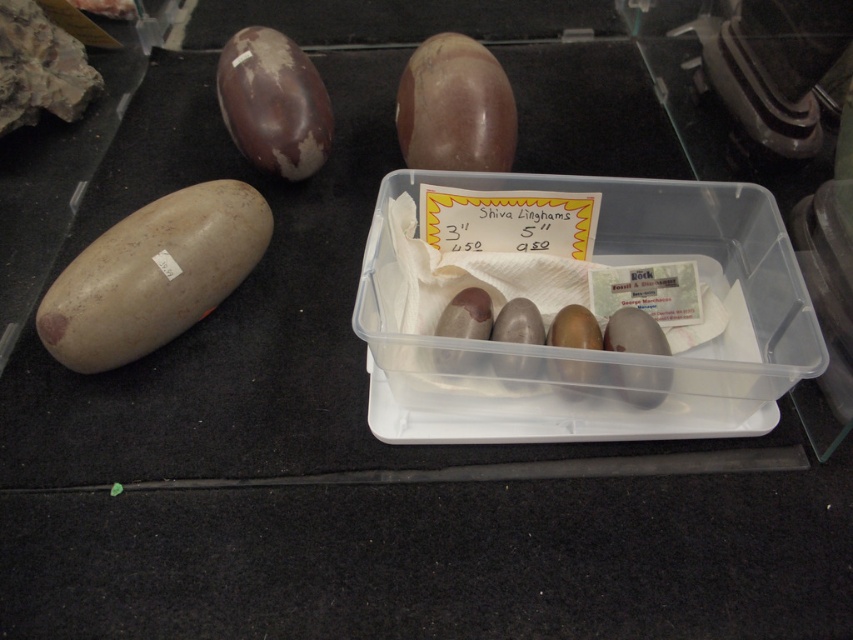
You are a customer at a store and see the matte brown potato at left and the brown matte egg at upper left displayed on a dark surface. Which object is taller?

The matte brown potato at left is taller than the brown matte egg at upper left.

Based on the scene description, where is the matte brown potato at left located in the image?

The matte brown potato at left is located at point (154,275) in the image.

You are a customer at a store and want to buy a Shiva Lingham. You see the shiny brown stone at upper center and the brown matte egg at upper left. Which one is shorter in height?

The shiny brown stone at upper center is not as tall as the brown matte egg at upper left, so the shiny brown stone at upper center is shorter in height.